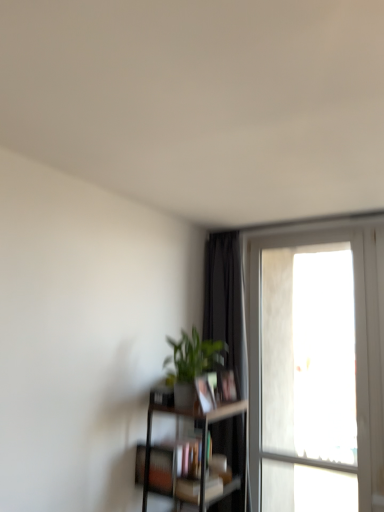
Question: From their relative heights in the image, would you say clear glass window at right is taller or shorter than matte black book at center, placed as the 1th book when sorted from top to bottom?

Choices:
 (A) short
 (B) tall

Answer: (B)

Question: Considering the positions of clear glass window at right and matte black book at center, placed as the 1th book when sorted from top to bottom, in the image, is clear glass window at right wider or thinner than matte black book at center, placed as the 1th book when sorted from top to bottom,?

Choices:
 (A) wide
 (B) thin

Answer: (A)

Question: Which object is positioned closest to the dark brown wooden shelf at lower center?

Choices:
 (A) clear glass window at right
 (B) hardcover book at center, the 4th book viewed from the top
 (C) hardcover book at center, the second book in the top-to-bottom sequence
 (D) matte black book at center, the 4th book when ordered from bottom to top
 (E) green matte plant at center

Answer: (B)

Question: Which object is positioned farthest from the green matte plant at center?

Choices:
 (A) hardcover book at center, arranged as the 3th book when ordered from the bottom
 (B) clear glass window at right
 (C) dark brown wooden shelf at lower center
 (D) matte black bookshelf at lower center, positioned as the 3th book in top-to-bottom order
 (E) hardcover book at center, the 4th book viewed from the top

Answer: (B)